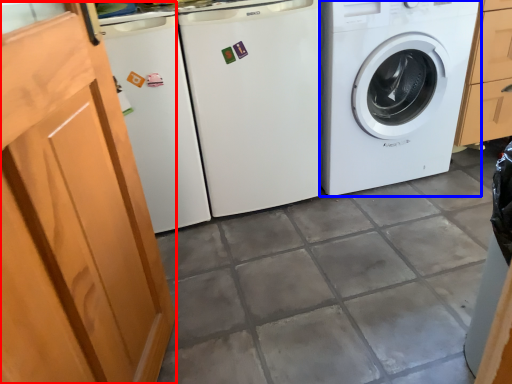
Question: Which object appears closest to the camera in this image, screen door (highlighted by a red box) or washing machine (highlighted by a blue box)?

Choices:
 (A) screen door
 (B) washing machine

Answer: (A)